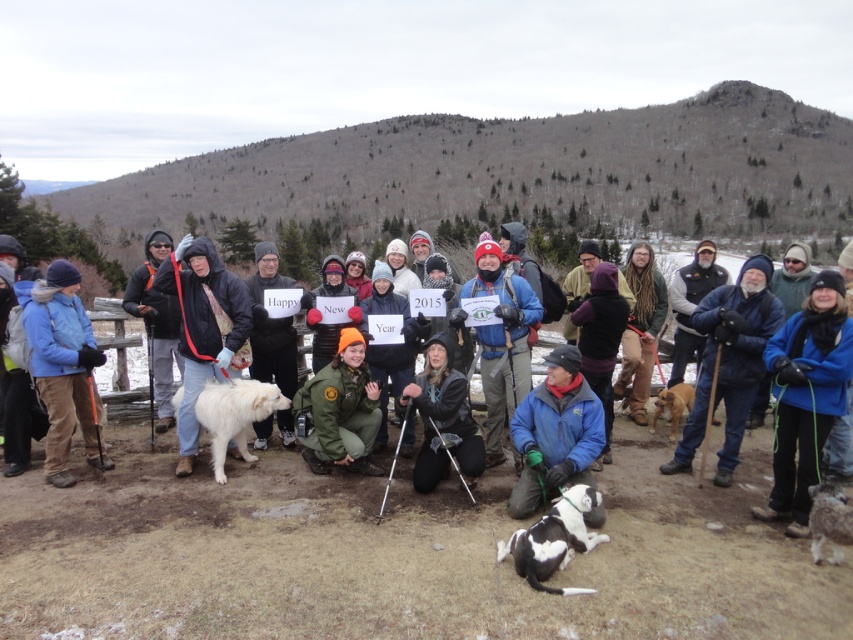
Consider the image. You are a photographer planning to take a group photo of the matte blue jacket at center and the green uniform at center. You want to ensure both are visible in the frame. Given their sizes, which object should you position closer to the camera to maintain clarity?

The matte blue jacket at center is wider than the green uniform at center. To maintain clarity in the photo, position the wider matte blue jacket at center farther from the camera and the narrower green uniform at center closer. This way, both will appear proportionally sized in the frame.

From the picture: You are a photographer standing at the edge of the mountain path. You want to take a photo of the matte black jacket at center and the green uniform at center so that both are fully visible. Which of the two should you focus on first to ensure the shorter one is in frame?

You should focus on the matte black jacket at center first because it is shorter than the green uniform at center, so ensuring it is in frame will help capture both fully.

You are a photographer trying to capture a photo of the group. You notice the black leather jacket at center and the black and white fur dog at lower center. Which object should you focus on first to ensure both are in the frame?

The black and white fur dog at lower center is behind the black leather jacket at center, so you should focus on the black leather jacket at center first to ensure both are in the frame.